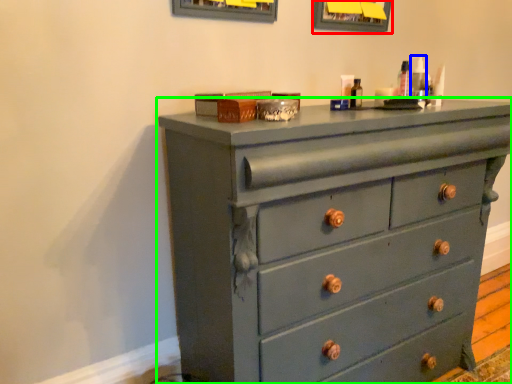
Question: Estimate the real-world distances between objects in this image. Which object is closer to picture frame (highlighted by a red box), toiletry (highlighted by a blue box) or chest of drawers (highlighted by a green box)?

Choices:
 (A) toiletry
 (B) chest of drawers

Answer: (A)